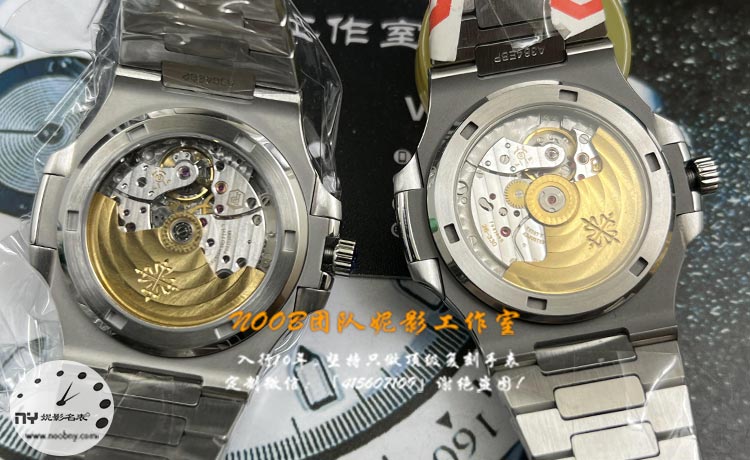
Locate an element on the screen. floor is located at coordinates (716, 329).